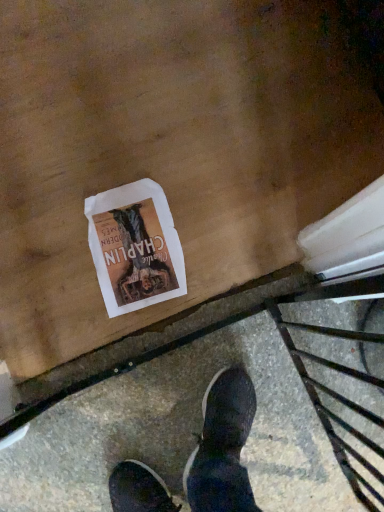
Question: From the image's perspective, is concrete pavement at lower center positioned above or below white paper flyer at center?

Choices:
 (A) below
 (B) above

Answer: (A)

Question: From their relative heights in the image, would you say concrete pavement at lower center is taller or shorter than white paper flyer at center?

Choices:
 (A) short
 (B) tall

Answer: (B)

Question: Is concrete pavement at lower center in front of or behind white paper flyer at center in the image?

Choices:
 (A) behind
 (B) front

Answer: (B)

Question: Is white paper flyer at center inside or outside of concrete pavement at lower center?

Choices:
 (A) outside
 (B) inside

Answer: (A)

Question: In the image, is white paper flyer at center on the left side or the right side of concrete pavement at lower center?

Choices:
 (A) left
 (B) right

Answer: (A)

Question: Is point [148, 192] closer or farther from the camera than point [165, 354]?

Choices:
 (A) farther
 (B) closer

Answer: (A)

Question: From the image's perspective, is white paper flyer at center located above or below concrete pavement at lower center?

Choices:
 (A) below
 (B) above

Answer: (B)